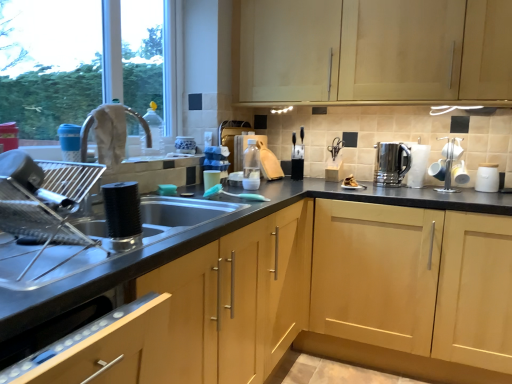
What do you see at coordinates (251, 161) in the screenshot?
I see `translucent plastic bottle at center, placed as the second bottle when sorted from front to back` at bounding box center [251, 161].

What is the approximate width of white matte jar at right, which is the second appliance from back to front?

white matte jar at right, which is the second appliance from back to front, is 3.48 inches in width.

What is the approximate height of white glossy mugs at right, the third appliance when ordered from left to right?

The height of white glossy mugs at right, the third appliance when ordered from left to right, is 11.50 inches.

The image size is (512, 384). What do you see at coordinates (413, 290) in the screenshot?
I see `light wood cabinet at center, positioned as the 2th cabinetry in bottom-to-top order` at bounding box center [413, 290].

What do you see at coordinates (211, 178) in the screenshot?
I see `matte plastic cup at sink, the fourth appliance from the right` at bounding box center [211, 178].

You are a GUI agent. You are given a task and a screenshot of the screen. Output one action in this format:
    pyautogui.click(x=<x>, y=<y>)
    Task: Click on the stainless steel kettle at right
    
    Given the screenshot: What is the action you would take?
    pyautogui.click(x=391, y=163)

Locate an element on the screen. The image size is (512, 384). translucent plastic bottle at center, which is the first bottle in right-to-left order is located at coordinates (251, 161).

Considering the positions of objects white glossy mugs at right, the third appliance when ordered from left to right, and silver metallic toaster at upper right, the 2th appliance from the left, in the image provided, who is behind, white glossy mugs at right, the third appliance when ordered from left to right, or silver metallic toaster at upper right, the 2th appliance from the left,?

silver metallic toaster at upper right, the 2th appliance from the left.

Where is `the 2nd appliance behind the white glossy mugs at right, which is the 3th appliance in back-to-front order, counting from the anchor's position`? This screenshot has height=384, width=512. the 2nd appliance behind the white glossy mugs at right, which is the 3th appliance in back-to-front order, counting from the anchor's position is located at coordinates (418, 165).

In terms of size, does white glossy mugs at right, the 2th appliance when ordered from front to back, appear bigger or smaller than silver metallic toaster at upper right, which ranks as the third appliance in right-to-left order?

Clearly, white glossy mugs at right, the 2th appliance when ordered from front to back, is larger in size than silver metallic toaster at upper right, which ranks as the third appliance in right-to-left order.

Based on the photo, is white glossy mugs at right, the 2th appliance when ordered from front to back, outside of silver metallic toaster at upper right, which ranks as the third appliance in right-to-left order?

white glossy mugs at right, the 2th appliance when ordered from front to back, lies outside silver metallic toaster at upper right, which ranks as the third appliance in right-to-left order,'s area.

Is point (497, 186) positioned in front of point (419, 150)?

Yes.

Is white matte jar at right, the fourth appliance viewed from the left, looking in the opposite direction of silver metallic toaster at upper right, the first appliance when ordered from back to front?

No.

Visually, is white matte jar at right, the third appliance viewed from the front, positioned to the left or to the right of silver metallic toaster at upper right, which ranks as the third appliance in right-to-left order?

From the image, it's evident that white matte jar at right, the third appliance viewed from the front, is to the right of silver metallic toaster at upper right, which ranks as the third appliance in right-to-left order.

Is the surface of translucent plastic bottle at center, placed as the second bottle when sorted from front to back, in direct contact with white matte jar at right, the first appliance in the right-to-left sequence?

No, translucent plastic bottle at center, placed as the second bottle when sorted from front to back, is not in contact with white matte jar at right, the first appliance in the right-to-left sequence.

Is white matte jar at right, which is the second appliance from back to front, surrounded by translucent plastic bottle at center, which appears as the second bottle when viewed from the left?

No, translucent plastic bottle at center, which appears as the second bottle when viewed from the left, does not contain white matte jar at right, which is the second appliance from back to front.

Is translucent plastic bottle at center, placed as the second bottle when sorted from front to back, positioned with its back to white matte jar at right, the fourth appliance viewed from the left?

No, translucent plastic bottle at center, placed as the second bottle when sorted from front to back, is not facing away from white matte jar at right, the fourth appliance viewed from the left.

Does translucent plastic bottle at center, placed as the second bottle when sorted from front to back, have a greater height compared to white matte jar at right, the third appliance viewed from the front?

Yes, translucent plastic bottle at center, placed as the second bottle when sorted from front to back, is taller than white matte jar at right, the third appliance viewed from the front.

From the picture: Could light wood cabinet at center, positioned as the 2th cabinetry in bottom-to-top order, be considered to be inside translucent plastic bottle at center, which appears as the second bottle when viewed from the left?

No, translucent plastic bottle at center, which appears as the second bottle when viewed from the left, does not contain light wood cabinet at center, positioned as the 2th cabinetry in bottom-to-top order.

Is translucent plastic bottle at center, which is the first bottle in right-to-left order, next to light wood cabinet at center, positioned as the 2th cabinetry in bottom-to-top order?

No, translucent plastic bottle at center, which is the first bottle in right-to-left order, is not next to light wood cabinet at center, positioned as the 2th cabinetry in bottom-to-top order.

Considering the sizes of translucent plastic bottle at center, placed as the second bottle when sorted from front to back, and light wood cabinet at center, positioned as the 2th cabinetry in bottom-to-top order, in the image, is translucent plastic bottle at center, placed as the second bottle when sorted from front to back, wider or thinner than light wood cabinet at center, positioned as the 2th cabinetry in bottom-to-top order,?

translucent plastic bottle at center, placed as the second bottle when sorted from front to back, is thinner than light wood cabinet at center, positioned as the 2th cabinetry in bottom-to-top order.

Is white glossy mugs at right, the 2th appliance when ordered from front to back, located within white matte jar at right, which is the second appliance from back to front?

Actually, white glossy mugs at right, the 2th appliance when ordered from front to back, is outside white matte jar at right, which is the second appliance from back to front.

Is white matte jar at right, which is the second appliance from back to front, to the left or to the right of white glossy mugs at right, the 2th appliance when ordered from front to back, in the image?

white matte jar at right, which is the second appliance from back to front, is positioned on white glossy mugs at right, the 2th appliance when ordered from front to back,'s right side.

Between white matte jar at right, the third appliance viewed from the front, and white glossy mugs at right, which is the 3th appliance in back-to-front order, which one has smaller size?

With smaller size is white matte jar at right, the third appliance viewed from the front.

Find the location of a particular element. appliance that is the 2nd one below the white glossy mugs at right, the 2th appliance when ordered from front to back (from a real-world perspective) is located at coordinates (487, 178).

Based on the photo, is stainless steel kettle at right touching light wood cabinet at center, which ranks as the first cabinetry in bottom-to-top order?

No, stainless steel kettle at right is not making contact with light wood cabinet at center, which ranks as the first cabinetry in bottom-to-top order.

Can you confirm if stainless steel kettle at right is positioned to the left of light wood cabinet at center, which ranks as the first cabinetry in bottom-to-top order?

No, stainless steel kettle at right is not to the left of light wood cabinet at center, which ranks as the first cabinetry in bottom-to-top order.

From a real-world perspective, count 1st cabinetrys downward from the stainless steel kettle at right and point to it. Please provide its 2D coordinates.

[(204, 244)]

Does stainless steel kettle at right lie behind light wood cabinet at center, which ranks as the first cabinetry in bottom-to-top order?

Yes, stainless steel kettle at right is further from the viewer.

Is matte silver faucet at upper left next to light wood cabinet at center, which ranks as the first cabinetry in bottom-to-top order?

No, matte silver faucet at upper left is not in contact with light wood cabinet at center, which ranks as the first cabinetry in bottom-to-top order.

In terms of width, does matte silver faucet at upper left look wider or thinner when compared to light wood cabinet at center, placed as the 3th cabinetry when sorted from top to bottom?

Considering their sizes, matte silver faucet at upper left looks slimmer than light wood cabinet at center, placed as the 3th cabinetry when sorted from top to bottom.

The height and width of the screenshot is (384, 512). In order to click on the 1st cabinetry to the right when counting from the matte silver faucet at upper left in this screenshot , I will do `click(204, 244)`.

Does point (82, 141) come behind point (313, 345)?

No, (82, 141) is in front of (313, 345).

From the white glossy mugs at right, the 2th appliance positioned from the right, count 2nd appliances backward and point to it. Please provide its 2D coordinates.

[(418, 165)]

The image size is (512, 384). What are the coordinates of `the 1st appliance in front of the silver metallic toaster at upper right, which ranks as the third appliance in right-to-left order` in the screenshot? It's located at (487, 178).

Estimate the real-world distances between objects in this image. Which object is further from light wood cabinet at upper center, the 1th cabinetry when ordered from top to bottom, light wood cabinet at center, placed as the 2th cabinetry when sorted from top to bottom, or matte plastic cup at sink, which appears as the 4th appliance when viewed from the back?

The object further to light wood cabinet at upper center, the 1th cabinetry when ordered from top to bottom, is matte plastic cup at sink, which appears as the 4th appliance when viewed from the back.

When comparing their distances from matte silver faucet at upper left, does light wood cabinet at center, placed as the 2th cabinetry when sorted from top to bottom, or silver metallic toaster at upper right, the first appliance when ordered from back to front, seem further?

The object further to matte silver faucet at upper left is light wood cabinet at center, placed as the 2th cabinetry when sorted from top to bottom.

Based on their spatial positions, is light wood cabinet at center, placed as the 3th cabinetry when sorted from top to bottom, or light wood cabinet at center, positioned as the 2th cabinetry in bottom-to-top order, further from silver metallic toaster at upper right, which ranks as the third appliance in right-to-left order?

light wood cabinet at center, placed as the 3th cabinetry when sorted from top to bottom.

Considering their positions, is matte silver faucet at upper left positioned closer to light wood cabinet at center, which ranks as the first cabinetry in bottom-to-top order, than silver metallic toaster at upper right, the first appliance when ordered from back to front?

silver metallic toaster at upper right, the first appliance when ordered from back to front.

Looking at the image, which one is located closer to transparent plastic bottle at upper center, the 1th bottle positioned from the front, light wood cabinet at center, placed as the 3th cabinetry when sorted from top to bottom, or matte silver faucet at upper left?

matte silver faucet at upper left.

From the image, which object appears to be nearer to transparent plastic bottle at upper center, the 1th bottle positioned from the front, matte silver faucet at upper left or matte plastic cup at sink, which appears as the 4th appliance when viewed from the back?

Based on the image, matte silver faucet at upper left appears to be nearer to transparent plastic bottle at upper center, the 1th bottle positioned from the front.

Based on their spatial positions, is matte plastic cup at sink, which appears as the 4th appliance when viewed from the back, or stainless steel kettle at right further from light wood cabinet at center, placed as the 3th cabinetry when sorted from top to bottom?

Based on the image, stainless steel kettle at right appears to be further to light wood cabinet at center, placed as the 3th cabinetry when sorted from top to bottom.

In the scene shown: Considering their positions, is transparent plastic bottle at upper center, which is counted as the 2th bottle, starting from the back, positioned further to stainless steel kettle at right than light wood cabinet at upper center, the 1th cabinetry when ordered from top to bottom?

The object further to stainless steel kettle at right is transparent plastic bottle at upper center, which is counted as the 2th bottle, starting from the back.

This screenshot has width=512, height=384. What are the coordinates of `kitchen appliance between matte plastic cup at sink, which appears as the 4th appliance when viewed from the back, and white matte jar at right, which is the second appliance from back to front, in the horizontal direction` in the screenshot? It's located at (391, 163).

What are the coordinates of `appliance between stainless steel kettle at right and white glossy mugs at right, the 2th appliance when ordered from front to back, from left to right` in the screenshot? It's located at (418, 165).

Image resolution: width=512 pixels, height=384 pixels. Identify the location of kitchen appliance between silver metallic toaster at upper right, the 4th appliance when ordered from front to back, and light wood cabinet at center, placed as the 2th cabinetry when sorted from top to bottom, in the up-down direction. (391, 163).

Where is `appliance between light wood cabinet at center, which ranks as the first cabinetry in bottom-to-top order, and translucent plastic bottle at center, which appears as the second bottle when viewed from the left, along the z-axis`? appliance between light wood cabinet at center, which ranks as the first cabinetry in bottom-to-top order, and translucent plastic bottle at center, which appears as the second bottle when viewed from the left, along the z-axis is located at coordinates (211, 178).